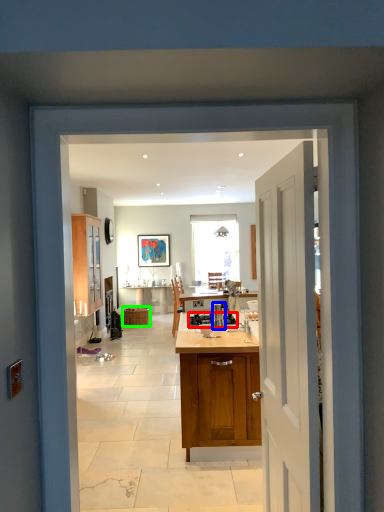
Question: Based on their relative distances, which object is farther from appliance (highlighted by a red box)? Choose from kitchen appliance (highlighted by a blue box) and cabinetry (highlighted by a green box).

Choices:
 (A) kitchen appliance
 (B) cabinetry

Answer: (B)